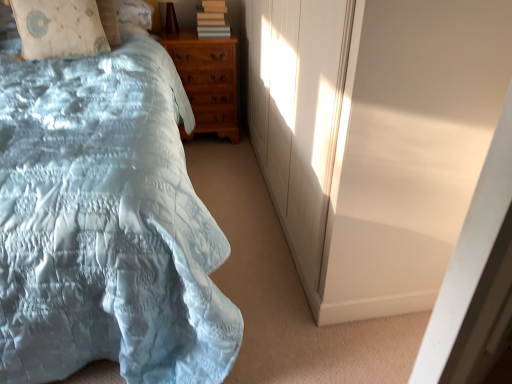
Question: Is light blue satin bed at left oriented away from matte gray book at upper center?

Choices:
 (A) yes
 (B) no

Answer: (B)

Question: Is light blue satin bed at left bigger than matte gray book at upper center?

Choices:
 (A) yes
 (B) no

Answer: (A)

Question: Is light blue satin bed at left wider than matte gray book at upper center?

Choices:
 (A) yes
 (B) no

Answer: (A)

Question: Can you confirm if light blue satin bed at left is positioned to the left of matte gray book at upper center?

Choices:
 (A) no
 (B) yes

Answer: (B)

Question: Would you say light blue satin bed at left contains matte gray book at upper center?

Choices:
 (A) no
 (B) yes

Answer: (A)

Question: In the image, is matte gray book at upper center positioned in front of or behind matte brown table lamp at upper center?

Choices:
 (A) front
 (B) behind

Answer: (B)

Question: Which is correct: matte gray book at upper center is inside matte brown table lamp at upper center, or outside of it?

Choices:
 (A) inside
 (B) outside

Answer: (B)

Question: From a real-world perspective, is matte gray book at upper center positioned above or below matte brown table lamp at upper center?

Choices:
 (A) below
 (B) above

Answer: (A)

Question: Looking at their shapes, would you say matte gray book at upper center is wider or thinner than matte brown table lamp at upper center?

Choices:
 (A) thin
 (B) wide

Answer: (B)

Question: From a real-world perspective, relative to light blue satin bed at left, is beige fabric pillow at upper left vertically above or below?

Choices:
 (A) above
 (B) below

Answer: (A)

Question: Does point (27, 16) appear closer or farther from the camera than point (4, 87)?

Choices:
 (A) closer
 (B) farther

Answer: (B)

Question: Is beige fabric pillow at upper left situated inside light blue satin bed at left or outside?

Choices:
 (A) outside
 (B) inside

Answer: (B)

Question: Would you say beige fabric pillow at upper left is to the left or to the right of light blue satin bed at left in the picture?

Choices:
 (A) right
 (B) left

Answer: (B)

Question: In terms of size, does white matte screen door at upper right appear bigger or smaller than beige fabric pillow at upper left?

Choices:
 (A) small
 (B) big

Answer: (B)

Question: Is point (430, 289) positioned closer to the camera than point (37, 51)?

Choices:
 (A) closer
 (B) farther

Answer: (A)